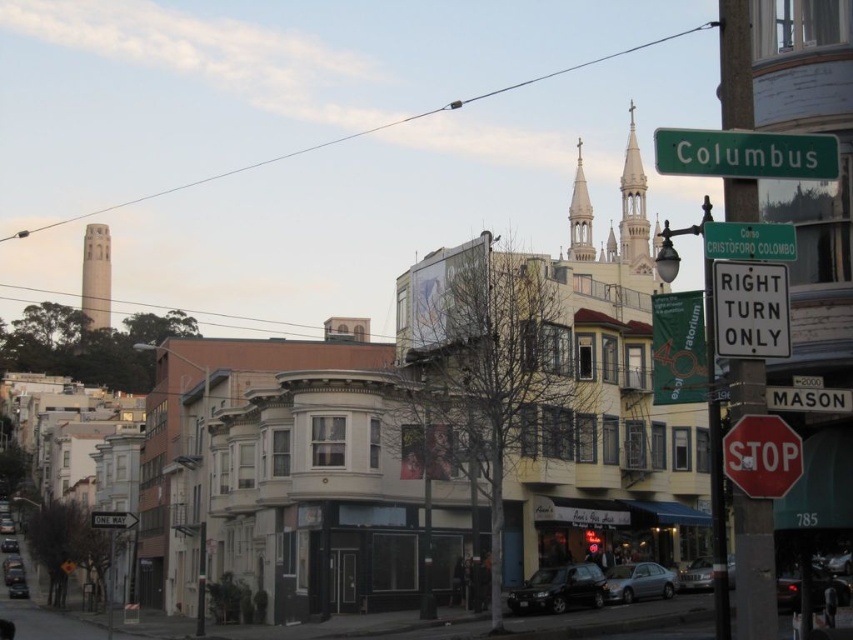
Which is more to the right, green metallic street sign at upper center or green plastic street sign at upper center?

Positioned to the right is green metallic street sign at upper center.

Is point (784, 154) farther from viewer compared to point (750, 227)?

That is False.

The image size is (853, 640). In order to click on green metallic street sign at upper center in this screenshot , I will do `click(746, 154)`.

Between smooth concrete tower at upper left and silver metallic sedan at center, which one has less height?

silver metallic sedan at center is shorter.

Is point (93, 262) more distant than point (685, 579)?

That is True.

Which is behind, point (106, 241) or point (692, 563)?

Point (106, 241)

Locate an element on the screen. This screenshot has height=640, width=853. smooth concrete tower at upper left is located at coordinates (96, 275).

Is red matte stop sign at lower right shorter than white plastic stop sign at lower right?

Incorrect, red matte stop sign at lower right's height does not fall short of white plastic stop sign at lower right's.

Consider the image. Is red matte stop sign at lower right closer to camera compared to white plastic stop sign at lower right?

Yes, red matte stop sign at lower right is closer to the viewer.

Which is behind, point (763, 429) or point (776, 410)?

The point (776, 410) is behind.

Where is `red matte stop sign at lower right`? This screenshot has width=853, height=640. red matte stop sign at lower right is located at coordinates (761, 456).